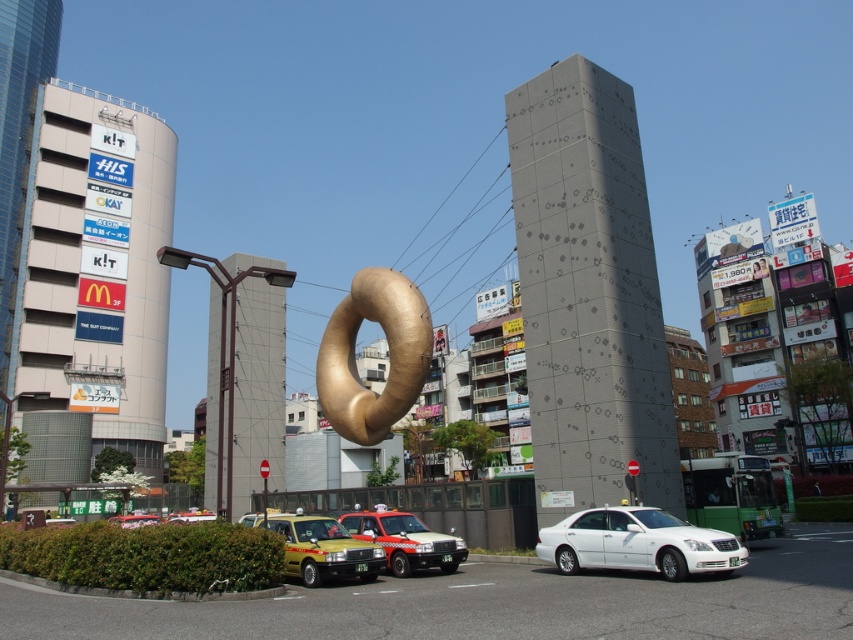
Question: Which point is farther to the camera?

Choices:
 (A) yellow matte taxi at lower left
 (B) red matte taxi at center
 (C) metallic yellow taxi at lower left

Answer: (B)

Question: Is white glossy sedan at center behind yellow matte taxi at lower left?

Choices:
 (A) yes
 (B) no

Answer: (B)

Question: Which point is farther to the camera?

Choices:
 (A) (346, 317)
 (B) (616, 541)
 (C) (399, 540)

Answer: (A)

Question: Does white glossy sedan at center come in front of yellow matte taxi at lower left?

Choices:
 (A) yes
 (B) no

Answer: (A)

Question: Does yellow matte taxi at lower left have a lesser width compared to metallic yellow taxi at lower left?

Choices:
 (A) yes
 (B) no

Answer: (A)

Question: Which object is positioned closest to the red matte taxi at center?

Choices:
 (A) white glossy sedan at center
 (B) metallic yellow taxi at lower left

Answer: (A)